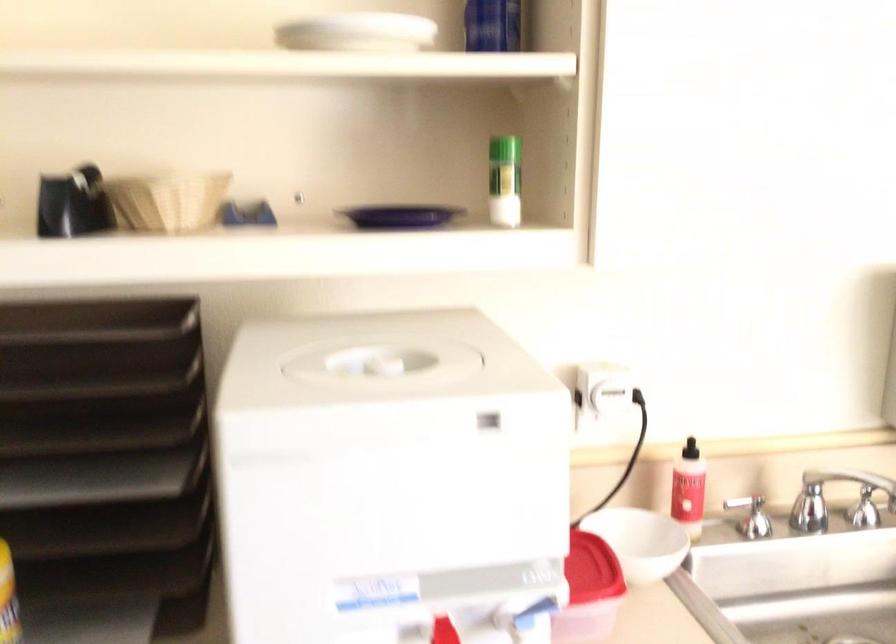
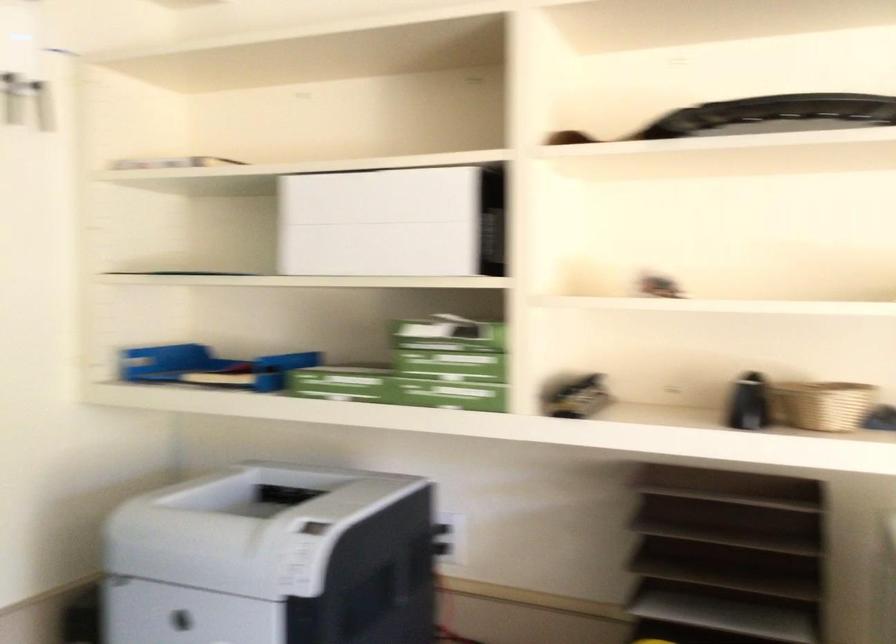
The point at (x=158, y=205) is marked in the first image. Where is the corresponding point in the second image?

(822, 404)